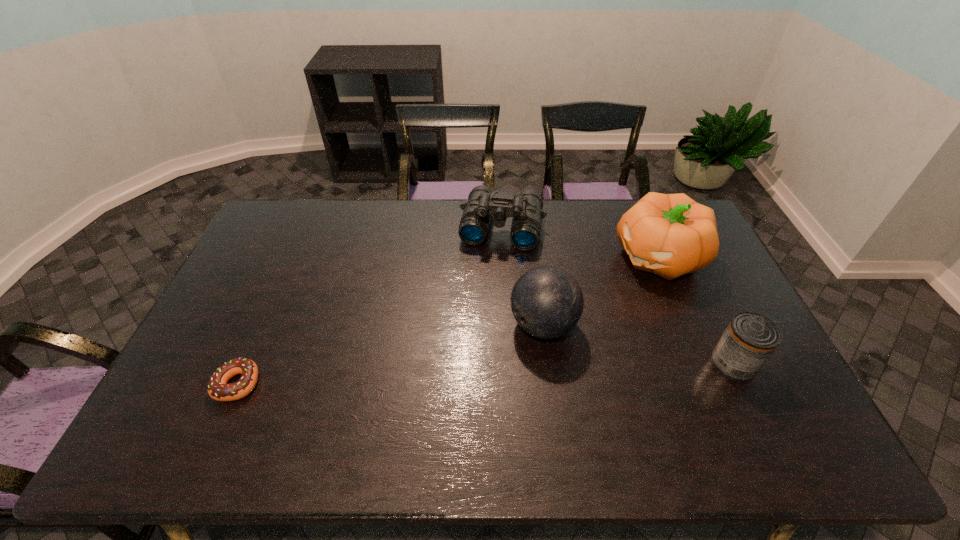
At what (x,y) coordinates should I click in order to perform the action: click on free space on the desktop that is between the shortest object and the can and is positioned on the grip area of the fourth shortest object. Please return your answer as a coordinate pair (x, y). The image size is (960, 540). Looking at the image, I should click on (458, 375).

Image resolution: width=960 pixels, height=540 pixels. Identify the location of free space on the desktop that is between the leftmost object and the can and is positioned through the lenses of the binoculars. (472, 374).

This screenshot has height=540, width=960. I want to click on free spot on the desktop that is between the doughnut and the can and is positioned on the carved face of the pumpkin, so click(465, 375).